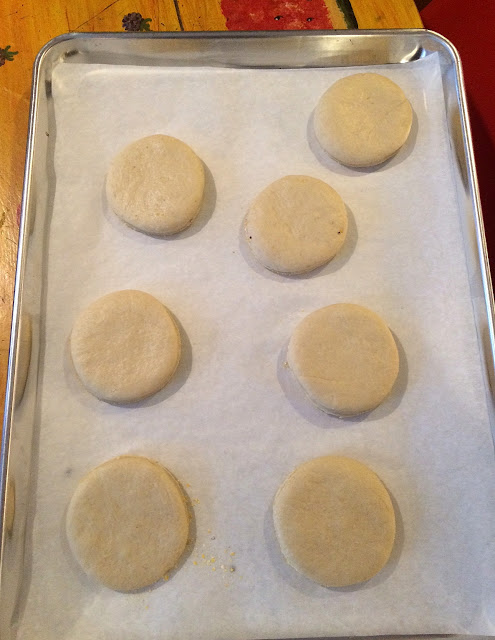
Where is `sheet`? sheet is located at coordinates (382, 139), (438, 552).